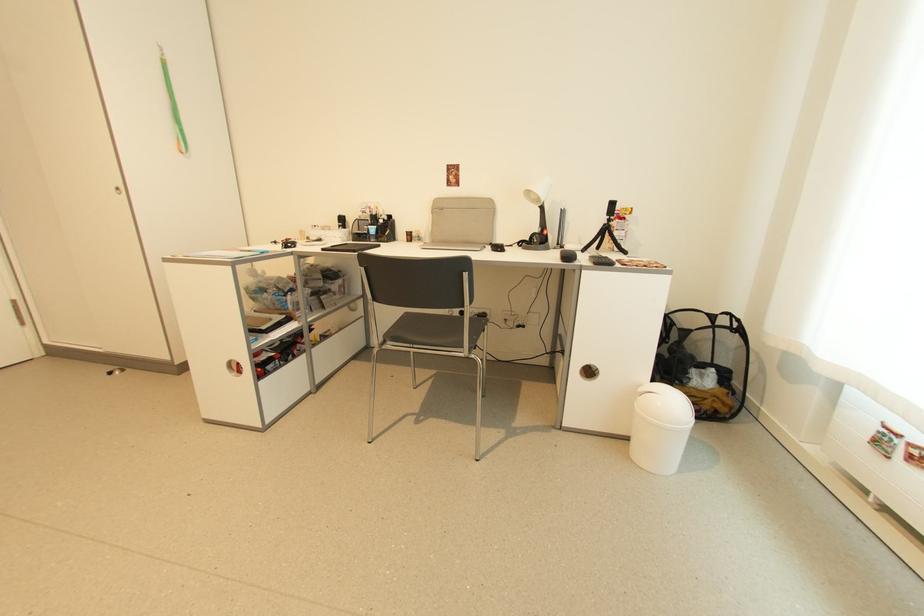
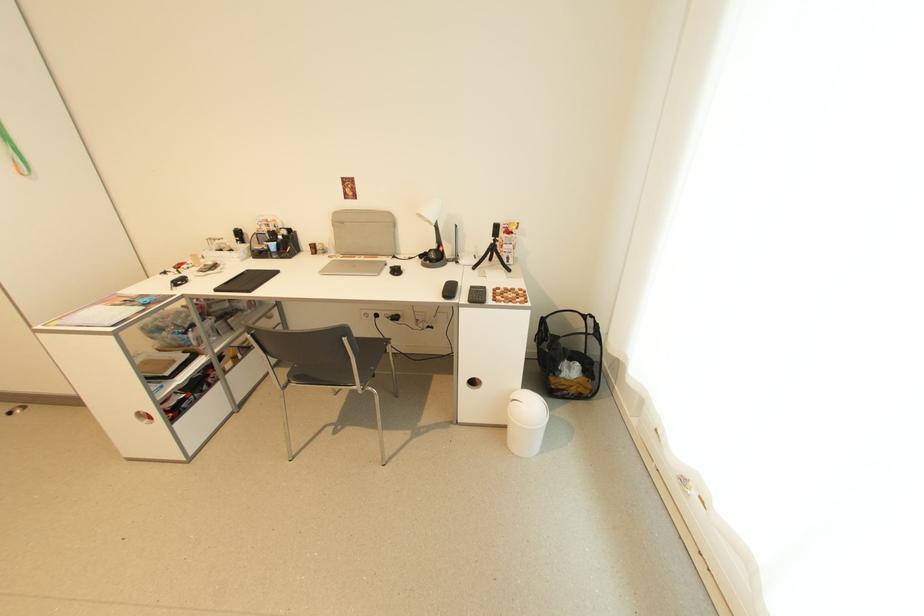
The point at (697, 386) is marked in the first image. Where is the corresponding point in the second image?

(566, 377)